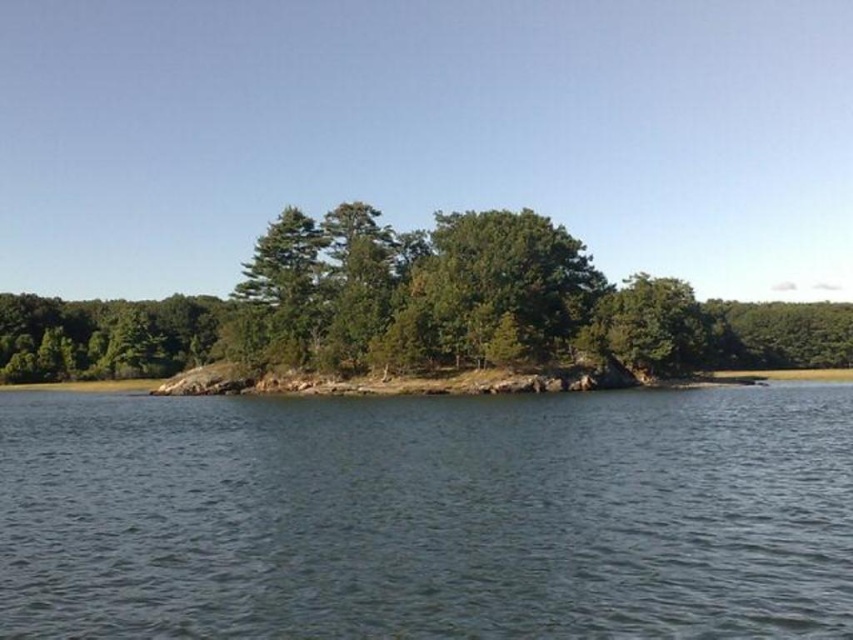
Question: Is clear water at center positioned at the back of green leafy tree at center?

Choices:
 (A) no
 (B) yes

Answer: (A)

Question: From the image, what is the correct spatial relationship of clear water at center in relation to green leafy tree at center?

Choices:
 (A) above
 (B) below

Answer: (B)

Question: Which object is farther from the camera taking this photo?

Choices:
 (A) clear water at center
 (B) green leafy tree at center

Answer: (B)

Question: In this image, where is clear water at center located relative to green leafy tree at center?

Choices:
 (A) left
 (B) right

Answer: (A)

Question: Which point is farther to the camera?

Choices:
 (A) (608, 394)
 (B) (448, 227)

Answer: (B)